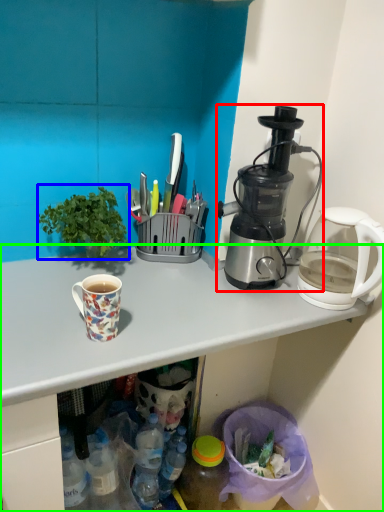
Question: Estimate the real-world distances between objects in this image. Which object is farther from blender (highlighted by a red box), houseplant (highlighted by a blue box) or desk (highlighted by a green box)?

Choices:
 (A) houseplant
 (B) desk

Answer: (A)